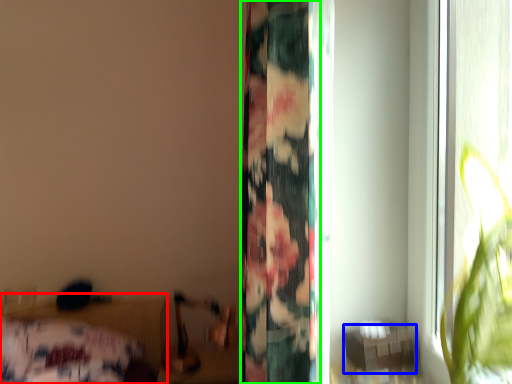
Question: Which is farther away from bed (highlighted by a red box)? table (highlighted by a blue box) or curtain (highlighted by a green box)?

Choices:
 (A) table
 (B) curtain

Answer: (A)